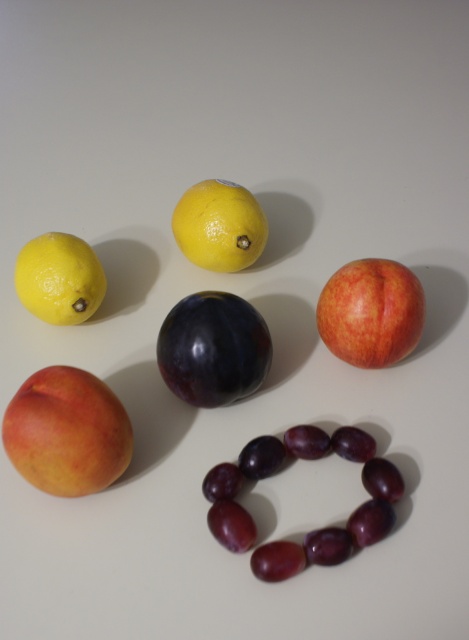
Question: Which point appears closest to the camera in this image?

Choices:
 (A) (93, 417)
 (B) (251, 262)
 (C) (409, 278)
 (D) (75, 278)

Answer: (A)

Question: Among these points, which one is nearest to the camera?

Choices:
 (A) (99, 273)
 (B) (423, 310)
 (C) (378, 515)
 (D) (251, 346)

Answer: (C)

Question: Which object is the farthest from the matte peach at lower left?

Choices:
 (A) shiny purple grapes at center
 (B) shiny dark purple plum at center
 (C) yellow matte lemon at center
 (D) matte peach at upper right

Answer: (D)

Question: Observing the image, what is the correct spatial positioning of matte peach at upper right in reference to matte yellow lemon at upper left?

Choices:
 (A) right
 (B) left

Answer: (A)

Question: Is shiny dark purple plum at center below matte peach at upper right?

Choices:
 (A) yes
 (B) no

Answer: (A)

Question: Observing the image, what is the correct spatial positioning of shiny dark purple plum at center in reference to matte yellow lemon at upper left?

Choices:
 (A) below
 (B) above

Answer: (A)